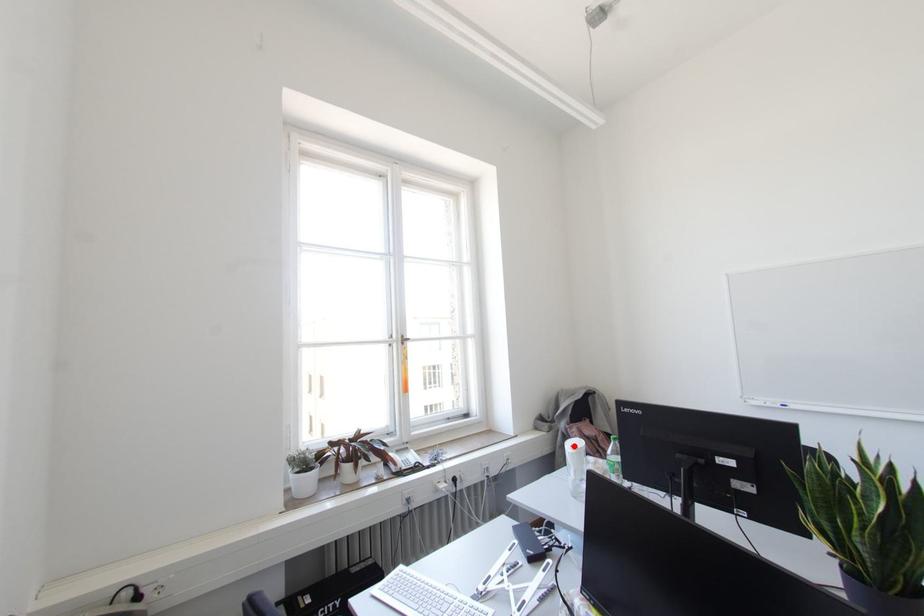
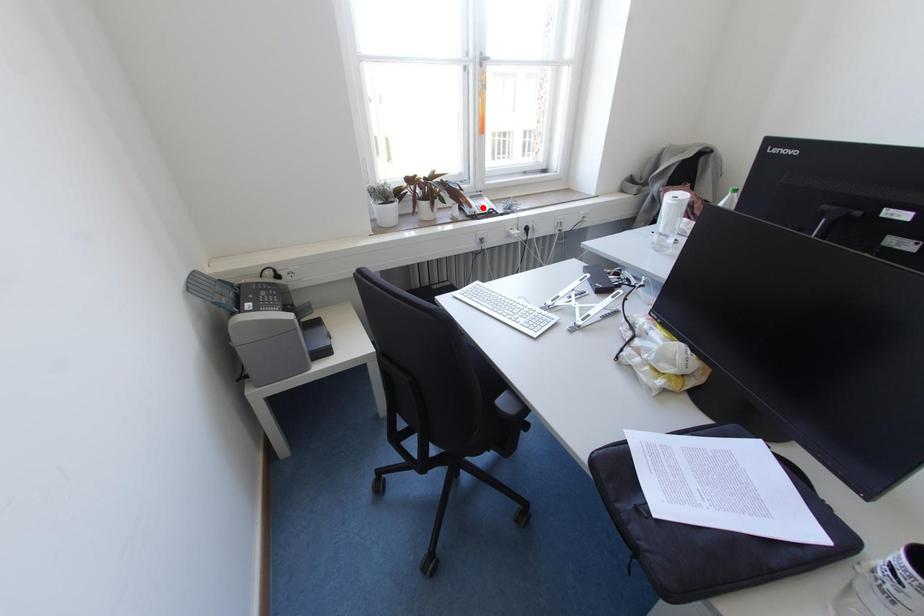
I am providing you with two images of the same scene from different viewpoints. A red point is marked on the first image and another point is marked on the second image. Is the red point in image1 aligned with the point shown in image2?

No